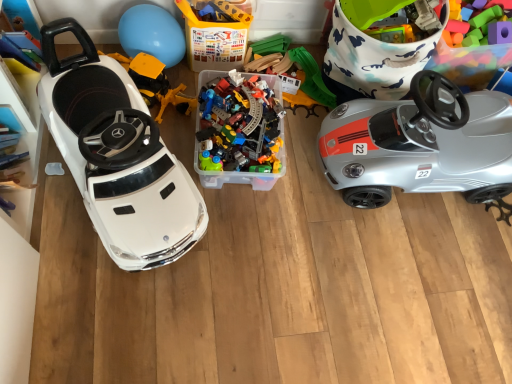
Question: Is translucent plastic container at center oriented towards silver metallic car at right, marked as the second car in a left-to-right arrangement?

Choices:
 (A) yes
 (B) no

Answer: (B)

Question: Is silver metallic car at right, marked as the second car in a left-to-right arrangement, at the back of translucent plastic container at center?

Choices:
 (A) no
 (B) yes

Answer: (A)

Question: Considering the relative sizes of translucent plastic container at center and silver metallic car at right, placed as the 1th car when sorted from right to left, in the image provided, is translucent plastic container at center thinner than silver metallic car at right, placed as the 1th car when sorted from right to left,?

Choices:
 (A) no
 (B) yes

Answer: (B)

Question: Is silver metallic car at right, placed as the 1th car when sorted from right to left, inside translucent plastic container at center?

Choices:
 (A) no
 (B) yes

Answer: (A)

Question: Does translucent plastic container at center lie in front of silver metallic car at right, marked as the second car in a left-to-right arrangement?

Choices:
 (A) yes
 (B) no

Answer: (B)

Question: Would you say translucent plastic container at center is inside or outside blue rubber balloon at upper center?

Choices:
 (A) inside
 (B) outside

Answer: (B)

Question: From a real-world perspective, is translucent plastic container at center positioned above or below blue rubber balloon at upper center?

Choices:
 (A) below
 (B) above

Answer: (B)

Question: From the image's perspective, is translucent plastic container at center located above or below blue rubber balloon at upper center?

Choices:
 (A) above
 (B) below

Answer: (A)

Question: From their relative heights in the image, would you say translucent plastic container at center is taller or shorter than blue rubber balloon at upper center?

Choices:
 (A) short
 (B) tall

Answer: (B)

Question: Considering their positions, is translucent plastic train set at center, the 2th toy positioned from the left, located in front of or behind blue rubber balloon at upper center?

Choices:
 (A) front
 (B) behind

Answer: (B)

Question: From the image's perspective, is translucent plastic train set at center, the 2th toy positioned from the left, located above or below blue rubber balloon at upper center?

Choices:
 (A) above
 (B) below

Answer: (B)

Question: Looking at the image, does translucent plastic train set at center, the 2th toy positioned from the left, seem bigger or smaller compared to blue rubber balloon at upper center?

Choices:
 (A) small
 (B) big

Answer: (B)

Question: Does point (309, 112) appear closer or farther from the camera than point (154, 26)?

Choices:
 (A) closer
 (B) farther

Answer: (B)

Question: Does point (133, 33) appear closer or farther from the camera than point (451, 56)?

Choices:
 (A) farther
 (B) closer

Answer: (B)

Question: Considering the positions of blue rubber balloon at upper center and rubberized plastic steering wheel at upper right, acting as the third toy starting from the left, in the image, is blue rubber balloon at upper center wider or thinner than rubberized plastic steering wheel at upper right, acting as the third toy starting from the left,?

Choices:
 (A) thin
 (B) wide

Answer: (A)